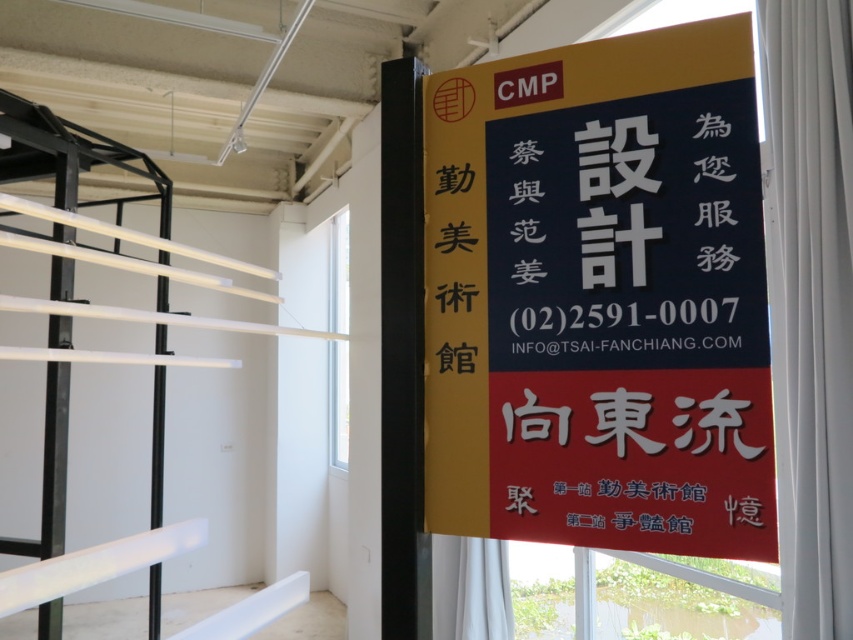
Question: Which point is farther from the camera taking this photo?

Choices:
 (A) (x=782, y=321)
 (B) (x=751, y=120)
 (C) (x=334, y=390)

Answer: (C)

Question: Among these objects, which one is nearest to the camera?

Choices:
 (A) white fabric curtain at right
 (B) transparent glass window at upper center

Answer: (A)

Question: Is white fabric curtain at right below transparent glass window at upper center?

Choices:
 (A) no
 (B) yes

Answer: (A)

Question: Considering the real-world distances, which object is closest to the matte black signboard at center?

Choices:
 (A) white fabric curtain at right
 (B) transparent glass window at upper center

Answer: (A)

Question: Does matte black signboard at center appear under white fabric curtain at right?

Choices:
 (A) yes
 (B) no

Answer: (A)

Question: Is matte black signboard at center bigger than white fabric curtain at right?

Choices:
 (A) no
 (B) yes

Answer: (A)